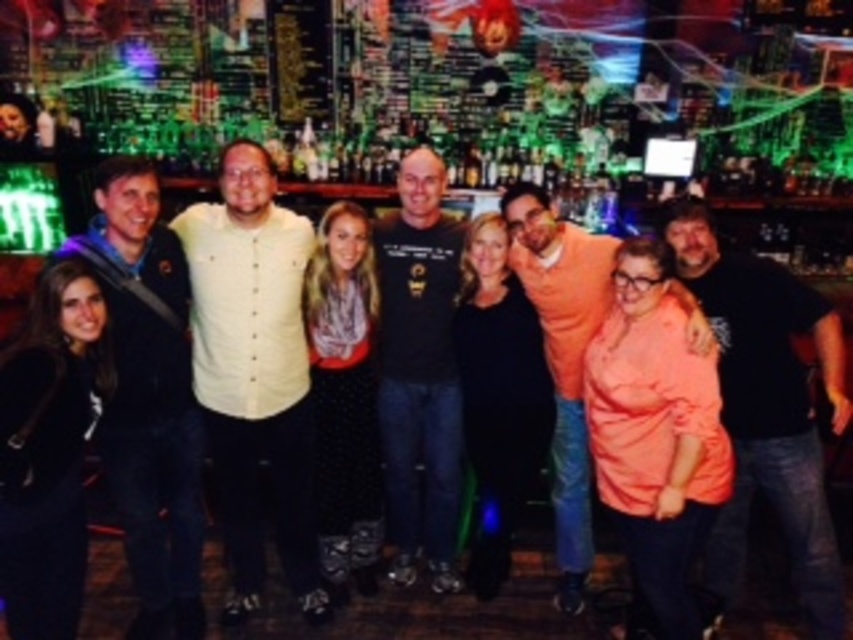
Question: Is dark blue jacket at left wider than orange cotton shirt at center?

Choices:
 (A) yes
 (B) no

Answer: (A)

Question: Which is nearer to the dark blue jacket at left?

Choices:
 (A) black matte shirt at center
 (B) light yellow button-up shirt at center

Answer: (B)

Question: Is dark blue jacket at left to the left of orange cotton shirt at center from the viewer's perspective?

Choices:
 (A) no
 (B) yes

Answer: (B)

Question: Which object is positioned farthest from the light yellow button-up shirt at center?

Choices:
 (A) black matte t-shirt at center
 (B) dark blue jacket at left

Answer: (A)

Question: Where is light yellow button-up shirt at center located in relation to dark blue jacket at left in the image?

Choices:
 (A) below
 (B) above

Answer: (B)

Question: Estimate the real-world distances between objects in this image. Which object is closer to the black matte t-shirt at center?

Choices:
 (A) dark blue jacket at left
 (B) orange cotton shirt at center
 (C) black matte shirt at center
 (D) light yellow button-up shirt at center

Answer: (B)